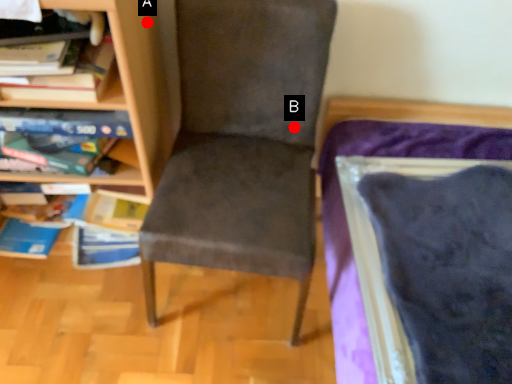
Question: Two points are circled on the image, labeled by A and B beside each circle. Which point is further to the camera?

Choices:
 (A) A is further
 (B) B is further

Answer: (B)